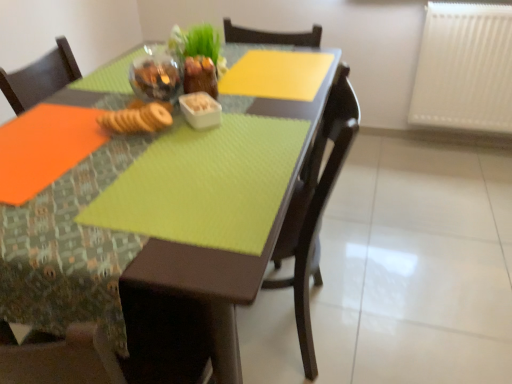
Question: Can we say matte brown chair at center lies outside translucent glass bowl at upper center, acting as the 1th tableware starting from the left?

Choices:
 (A) yes
 (B) no

Answer: (A)

Question: From the image's perspective, is matte brown chair at center below translucent glass bowl at upper center, acting as the 1th tableware starting from the left?

Choices:
 (A) no
 (B) yes

Answer: (B)

Question: Does matte brown chair at center touch translucent glass bowl at upper center, the second tableware viewed from the right?

Choices:
 (A) no
 (B) yes

Answer: (A)

Question: Does matte brown chair at center have a lesser width compared to translucent glass bowl at upper center, acting as the 1th tableware starting from the left?

Choices:
 (A) no
 (B) yes

Answer: (A)

Question: Can you confirm if matte brown chair at center is taller than translucent glass bowl at upper center, the second tableware viewed from the right?

Choices:
 (A) yes
 (B) no

Answer: (A)

Question: Is the depth of matte brown chair at center greater than that of translucent glass bowl at upper center, acting as the 1th tableware starting from the left?

Choices:
 (A) yes
 (B) no

Answer: (B)

Question: Is white plastic radiator at upper right positioned in front of brown crumbly biscuit at center?

Choices:
 (A) yes
 (B) no

Answer: (B)

Question: From a real-world perspective, is white plastic radiator at upper right beneath brown crumbly biscuit at center?

Choices:
 (A) yes
 (B) no

Answer: (A)

Question: Is white plastic radiator at upper right shorter than brown crumbly biscuit at center?

Choices:
 (A) yes
 (B) no

Answer: (B)

Question: From a real-world perspective, does white plastic radiator at upper right stand above brown crumbly biscuit at center?

Choices:
 (A) yes
 (B) no

Answer: (B)

Question: Is white plastic radiator at upper right touching brown crumbly biscuit at center?

Choices:
 (A) yes
 (B) no

Answer: (B)

Question: Is white plastic radiator at upper right not within brown crumbly biscuit at center?

Choices:
 (A) no
 (B) yes

Answer: (B)

Question: Is matte brown chair at center turned away from white plastic radiator at upper right?

Choices:
 (A) no
 (B) yes

Answer: (A)